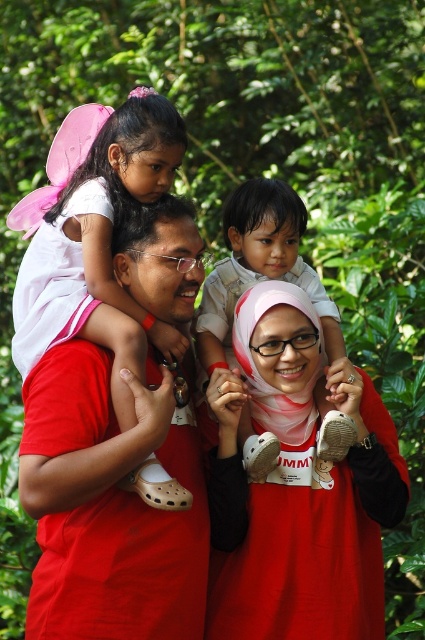
Question: Considering the relative positions of matte red hijab at center and light beige cotton shirt at center in the image provided, where is matte red hijab at center located with respect to light beige cotton shirt at center?

Choices:
 (A) right
 (B) left

Answer: (A)

Question: In this image, where is pink fabric wings at upper left located relative to light beige cotton shirt at center?

Choices:
 (A) left
 (B) right

Answer: (A)

Question: Which of the following is the closest to the observer?

Choices:
 (A) (197, 477)
 (B) (14, 316)
 (C) (252, 269)
 (D) (291, 547)

Answer: (D)

Question: Estimate the real-world distances between objects in this image. Which object is closer to the matte red hijab at center?

Choices:
 (A) light beige cotton shirt at center
 (B) matte red shirt at center
 (C) pink fabric wings at upper left

Answer: (A)

Question: Which point appears farthest from the camera in this image?

Choices:
 (A) (283, 237)
 (B) (36, 264)

Answer: (A)

Question: Does matte red hijab at center have a larger size compared to pink fabric wings at upper left?

Choices:
 (A) yes
 (B) no

Answer: (B)